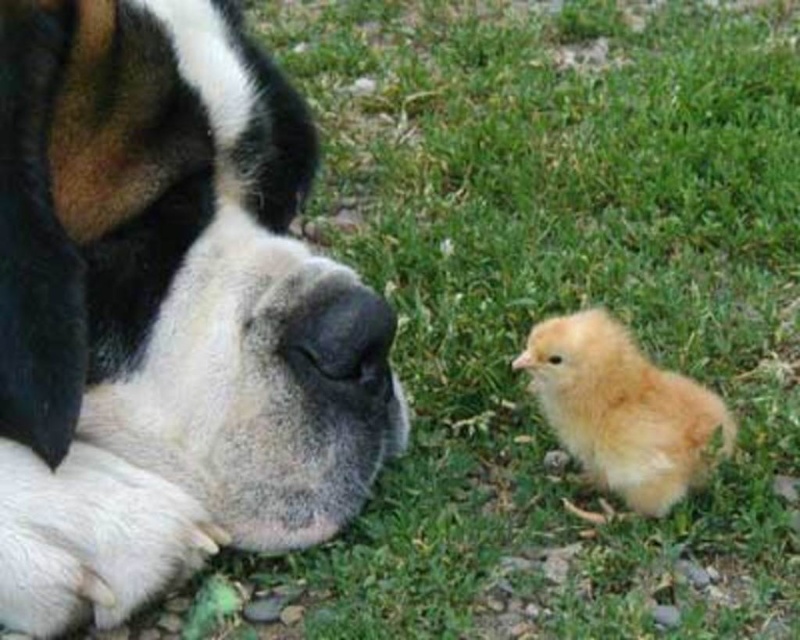
You are a bird flying above the scene. You notice the green grass at lower right and the white fur dog at center. Which one appears taller from your viewpoint?

The green grass at lower right has a greater height compared to the white fur dog at center, so from above, the green grass at lower right appears taller.

In the scene shown: You are a photographer trying to capture the interaction between the large dog and small chick. You want to ensure the green grass at lower right and black matte nose at lower center are both visible in the frame. Based on their positions, which object is closer to the right edge of the photo?

The green grass at lower right is to the right of the black matte nose at lower center, so it is closer to the right edge of the photo.